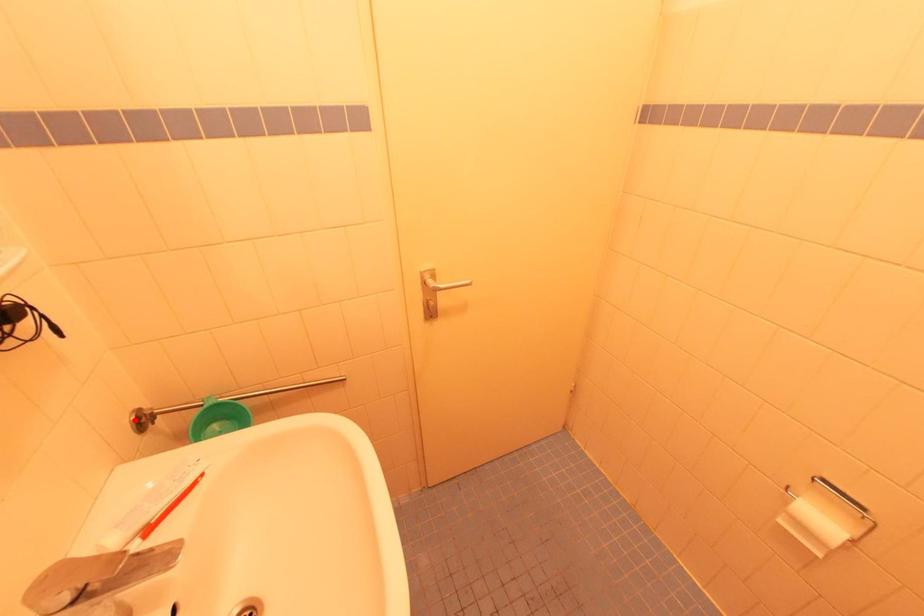
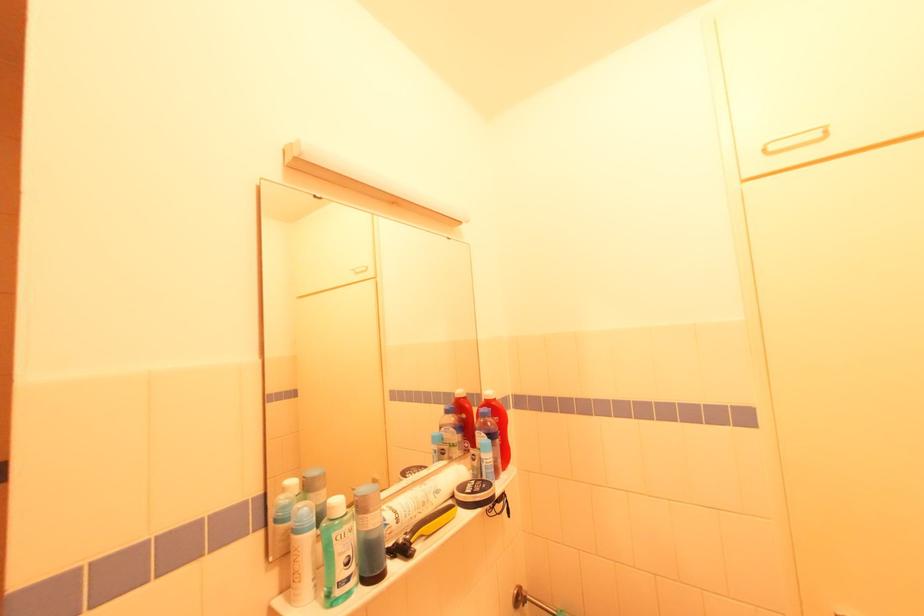
In the second image, find the point that corresponds to the highlighted location in the first image.

(517, 594)